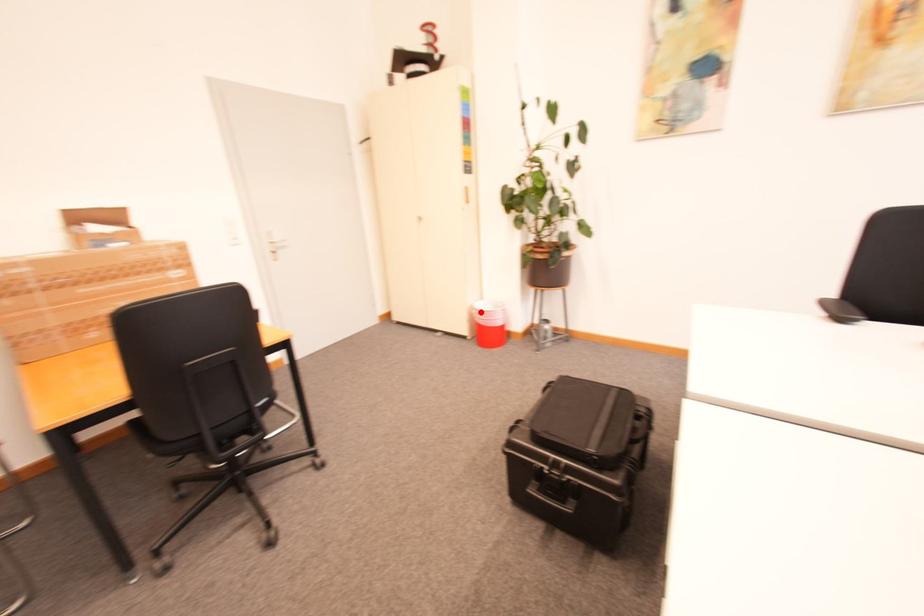
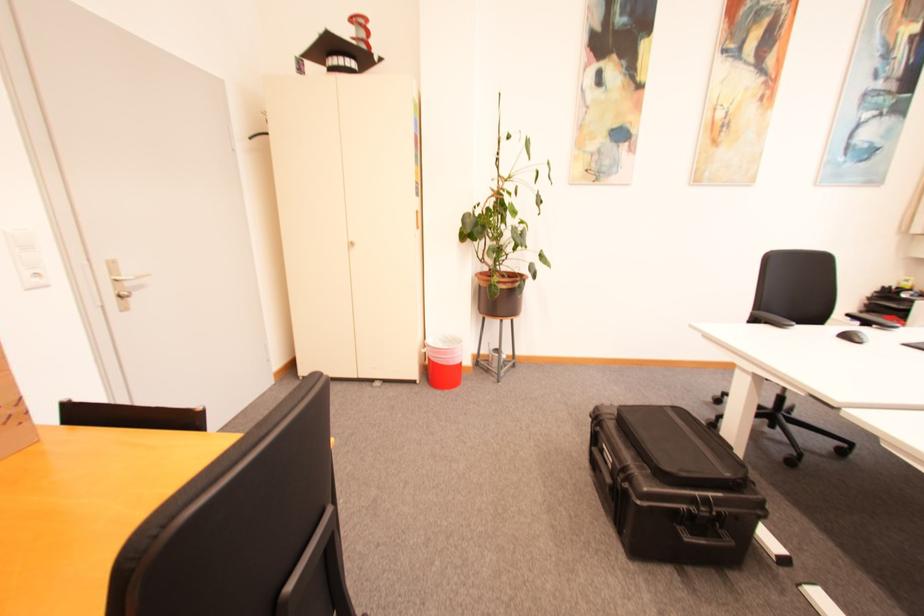
The point at the highlighted location is marked in the first image. Where is the corresponding point in the second image?

(431, 351)